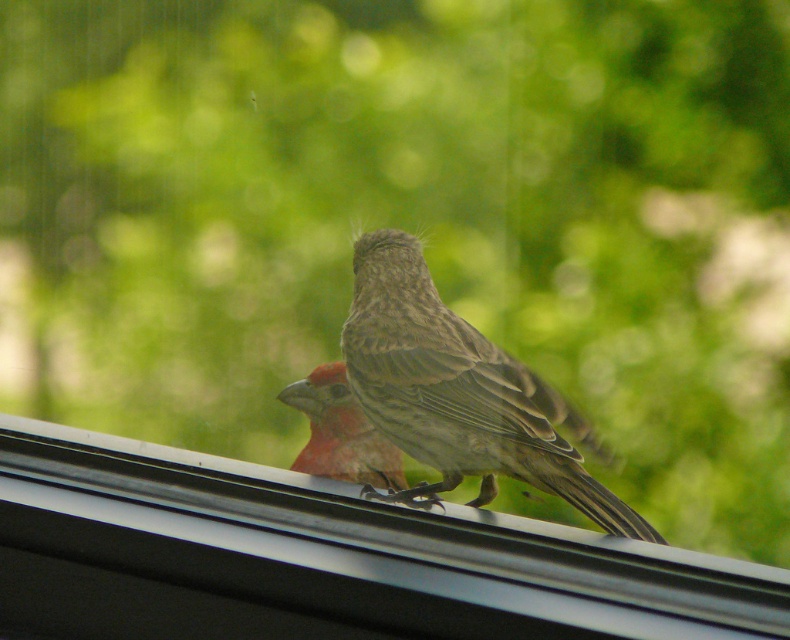
You are a birdhouse builder who wants to place a new feeder on the black plastic window sill at upper center. The feeder requires a minimum of 20 cm of space. Can the brown speckled sparrow at center currently perched on the window sill accommodate the feeder without moving?

The black plastic window sill at upper center has a larger size compared to brown speckled sparrow at center, so there is enough space for the feeder as long as the sparrow moves. However, the question states the sparrow is currently perched there. Since the sparrow is smaller than the sill, if it moves aside, the feeder can be placed. If it stays, the space may be insufficient depending on the sparrow size relative to the feeder. But according to the description, the sill is larger than the sparrow, so if

You are a birdhouse builder checking the dimensions of the black plastic window sill at upper center and the brown speckled sparrow at center. Which object is shorter in height?

The black plastic window sill at upper center is shorter in height compared to the brown speckled sparrow at center according to the description.